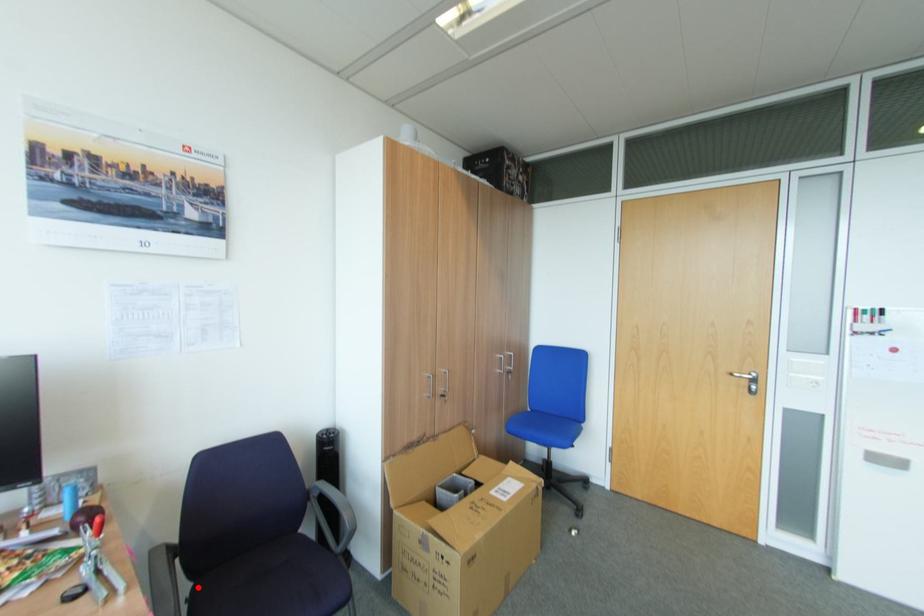
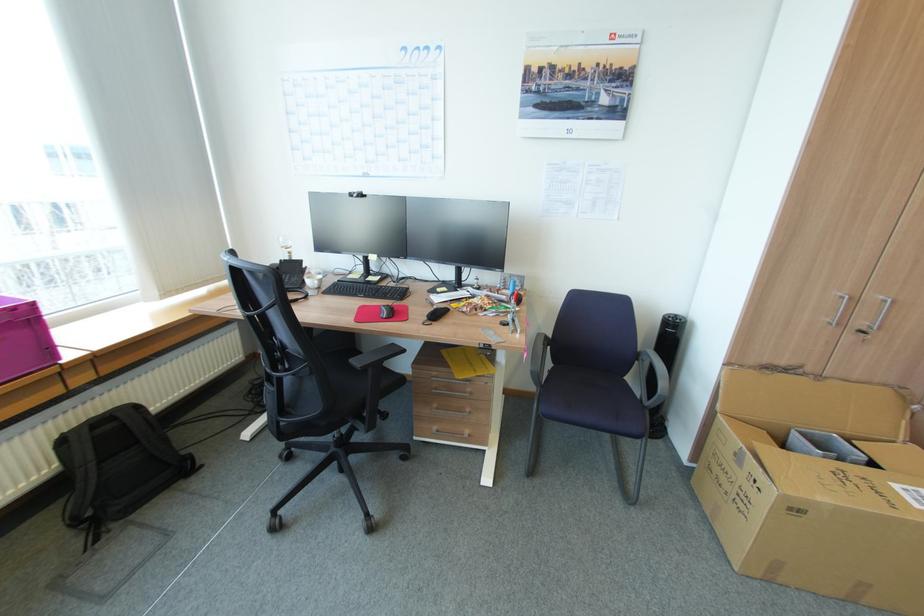
Locate, in the second image, the point that corresponds to the highlighted location in the first image.

(557, 368)